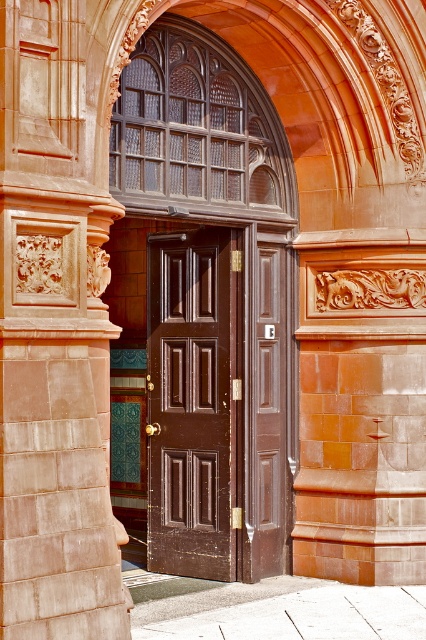
You are standing in front of a building entrance and want to estimate how far the matte brown door at center is from you. Based on the scene, can you determine the distance?

The matte brown door at center is 9.37 meters away from the viewer.

You are a painter hired to paint the doors of a building. You notice two doors at the entrance, a matte brown door at center and a shiny dark wood door at center. Which door should you paint first according to their positions?

The matte brown door at center is in front of the shiny dark wood door at center, so you should paint the matte brown door at center first before the shiny dark wood door at center to avoid getting paint on the one behind.

You are a delivery person trying to enter the building. You see the matte brown door at center and the shiny dark wood door at center. Which door should you use to enter?

The shiny dark wood door at center is the correct entrance because the matte brown door at center is located above it and likely part of the decorative archway, not an actual entry point.